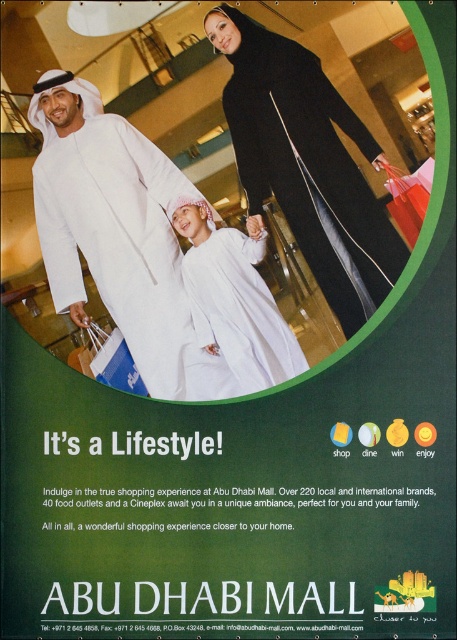
What object is located at the coordinate point (116,234) in the image?

The point (116,234) corresponds to the white matte abaya at center.

You are standing in front of the Abu Dhabi Mall advertisement and want to touch the point at coordinates point [246,148]. If your arm can reach up to 2 feet, can you reach the point?

The point [246,148] is 5.26 feet away from you, which is farther than your 2 feet reach. You cannot reach it.